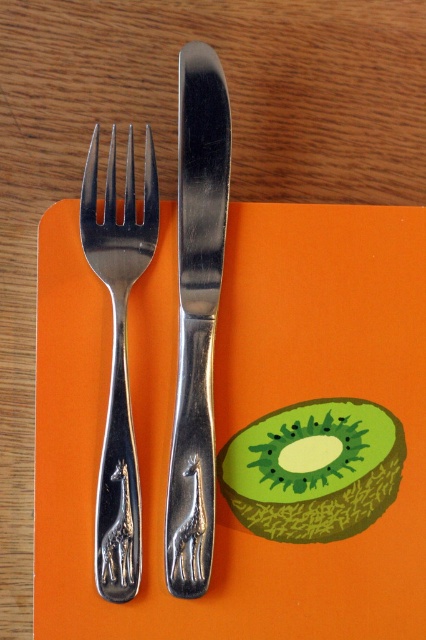
You are a server who needs to place a napkin between the polished metal knife at center and the green matte kiwi at center. The napkin is 6 inches wide. Can you fit it between them?

The polished metal knife at center and green matte kiwi at center are 6.67 inches apart from each other. Since the napkin is 6 inches wide, it can fit between them with some space to spare.

You are arranging a table setting and need to place a new spoon next to the polished metal knife at center. According to the image, where should you position the spoon relative to the knife?

The spoon should be placed to the right of the polished metal knife at center since the knife is located at point (x=196, y=316) and the kiwi fruit illustration is to the right of the utensils.

You are a server arranging a table. You need to place a napkin between the polished silver fork at left and the green matte kiwi at center. Which object should the napkin be closer to?

The napkin should be closer to the green matte kiwi at center because the polished silver fork at left is behind it, so placing the napkin in front would be near the kiwi.